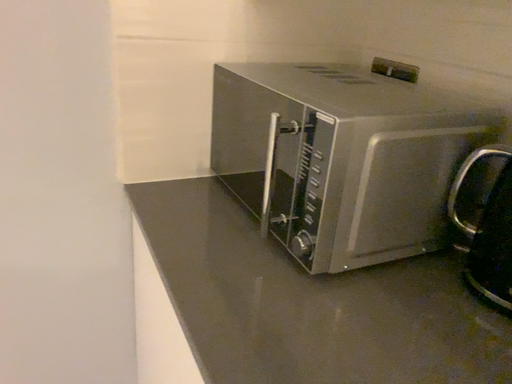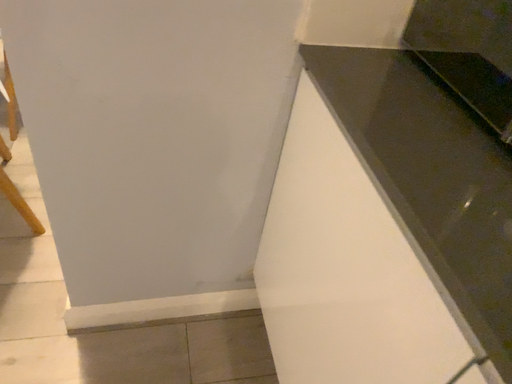
Question: How did the camera likely rotate when shooting the video?

Choices:
 (A) rotated right
 (B) rotated left

Answer: (B)